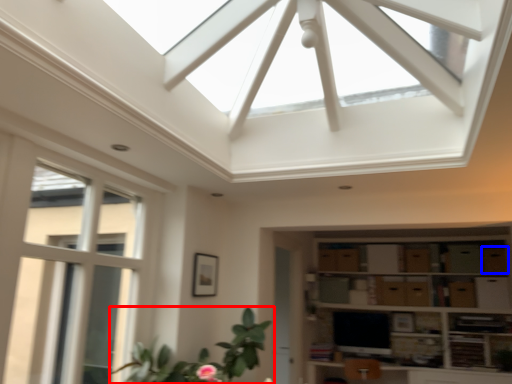
Question: Among these objects, which one is nearest to the camera, houseplant (highlighted by a red box) or drawer (highlighted by a blue box)?

Choices:
 (A) houseplant
 (B) drawer

Answer: (A)